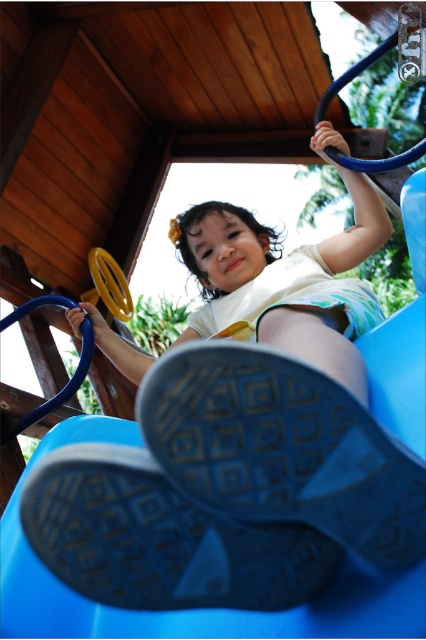
You are a parent trying to ensure your child is safe while playing. You see the matte blue slide at lower center and the smooth white shirt at center. How far apart are these two items?

The matte blue slide at lower center and the smooth white shirt at center are 31.05 inches apart from each other.

Based on the scene description, can you determine the position of the matte blue slide at lower center relative to the smooth white shirt at center?

The matte blue slide at lower center is positioned to the right of the smooth white shirt at center.